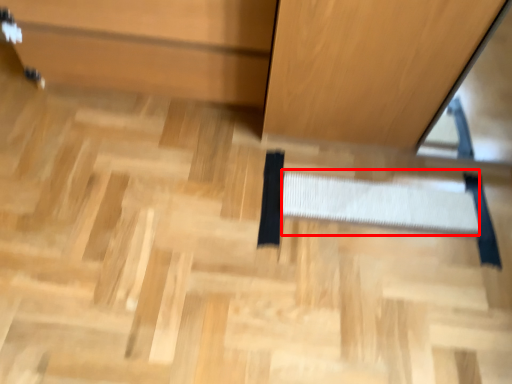
Question: Considering the relative positions of stair (annotated by the red box) and cabinetry in the image provided, where is stair (annotated by the red box) located with respect to the staircase?

Choices:
 (A) left
 (B) right

Answer: (B)